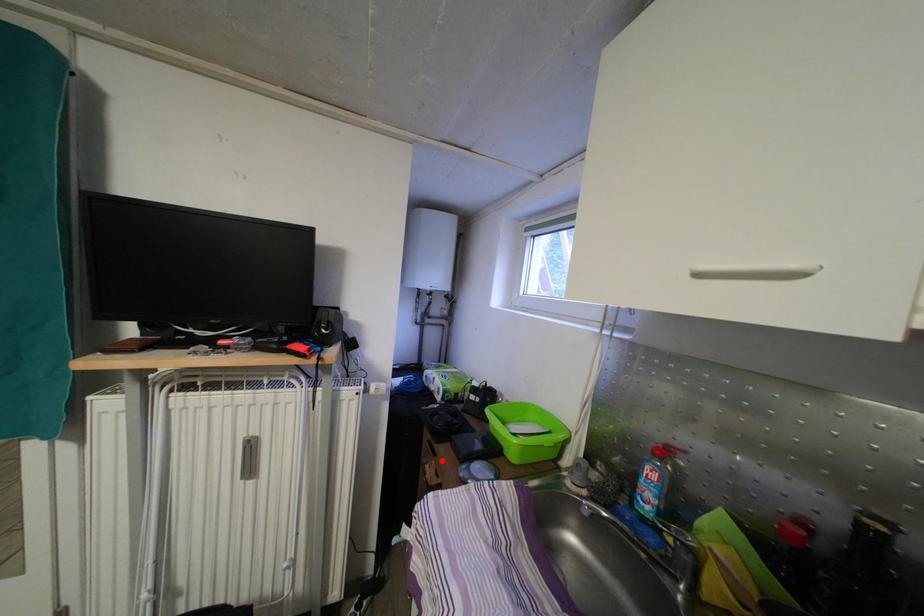
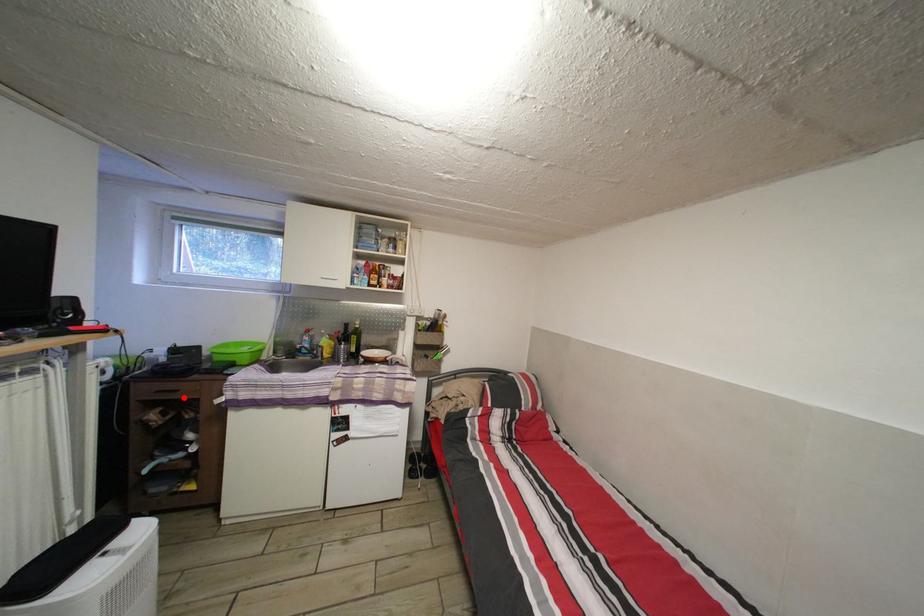
I am providing you with two images of the same scene from different viewpoints. A red point is marked on the first image and another point is marked on the second image. Does the point marked in image1 correspond to the same location as the one in image2?

Yes